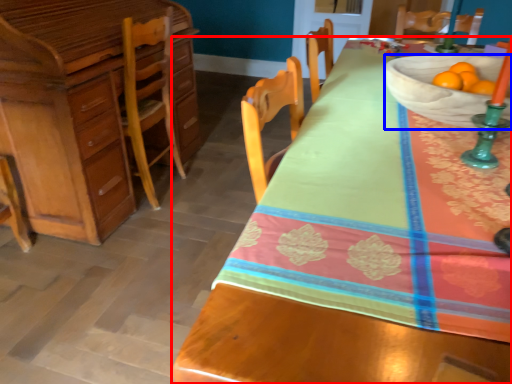
Question: Which object appears farthest to the camera in this image, desk (highlighted by a red box) or bowl (highlighted by a blue box)?

Choices:
 (A) desk
 (B) bowl

Answer: (B)